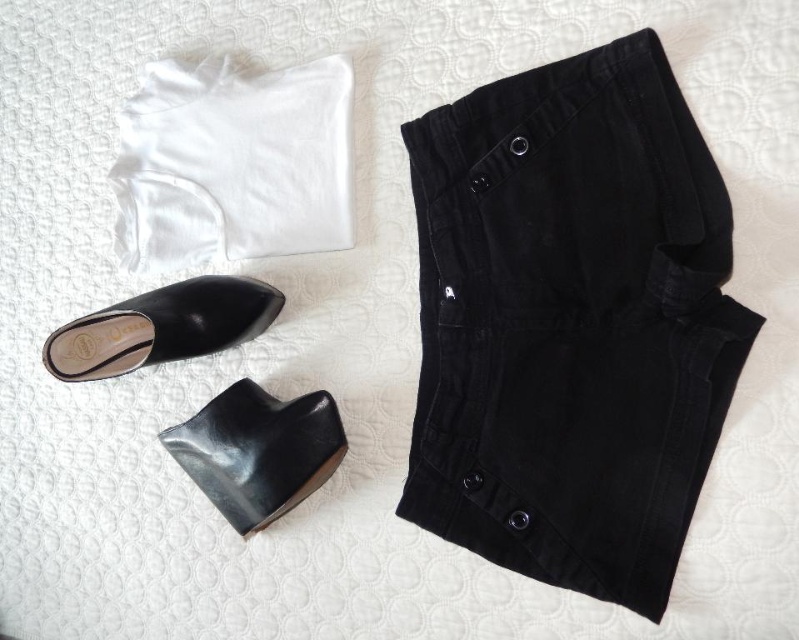
Question: Among these objects, which one is nearest to the camera?

Choices:
 (A) black leather dress shoe at lower left
 (B) white smooth t-shirt at upper left

Answer: (A)

Question: Among these objects, which one is nearest to the camera?

Choices:
 (A) black leather shoe at lower left
 (B) black leather dress shoe at lower left
 (C) black corduroy shorts at center
 (D) white smooth t-shirt at upper left

Answer: (C)

Question: Is black corduroy shorts at center bigger than white smooth t-shirt at upper left?

Choices:
 (A) yes
 (B) no

Answer: (A)

Question: Where is white smooth t-shirt at upper left located in relation to black leather dress shoe at lower left in the image?

Choices:
 (A) below
 (B) above

Answer: (B)

Question: Estimate the real-world distances between objects in this image. Which object is farther from the black leather dress shoe at lower left?

Choices:
 (A) black corduroy shorts at center
 (B) black leather shoe at lower left
 (C) white smooth t-shirt at upper left

Answer: (A)

Question: Where is black corduroy shorts at center located in relation to black leather shoe at lower left in the image?

Choices:
 (A) below
 (B) above

Answer: (B)